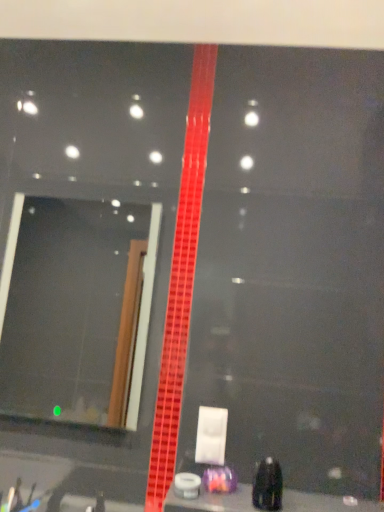
Question: Considering the positions of smooth black surface at bottom and black plastic bottle at lower right, which is the second toiletry from left to right, in the image, is smooth black surface at bottom wider or thinner than black plastic bottle at lower right, which is the second toiletry from left to right,?

Choices:
 (A) wide
 (B) thin

Answer: (A)

Question: Is smooth black surface at bottom inside or outside of black plastic bottle at lower right, which is the first toiletry in right-to-left order?

Choices:
 (A) inside
 (B) outside

Answer: (B)

Question: Estimate the real-world distances between objects in this image. Which object is closer to the smooth black surface at bottom?

Choices:
 (A) black plastic bottle at lower right, positioned as the 1th toiletry in front-to-back order
 (B) matte glass mirror at left
 (C) translucent purple container at center, which is counted as the second toiletry, starting from the front

Answer: (A)

Question: Which is farther from the smooth black surface at bottom?

Choices:
 (A) matte glass mirror at left
 (B) black plastic bottle at lower right, which is the second toiletry from left to right
 (C) translucent purple container at center, acting as the 2th toiletry starting from the right

Answer: (A)